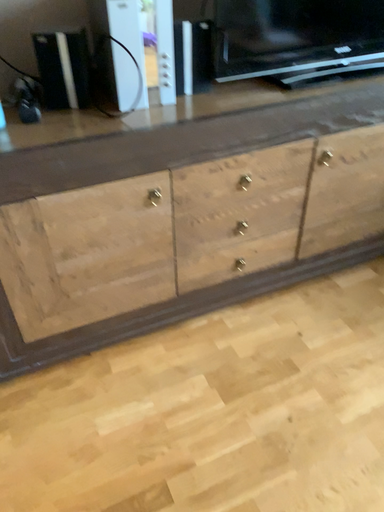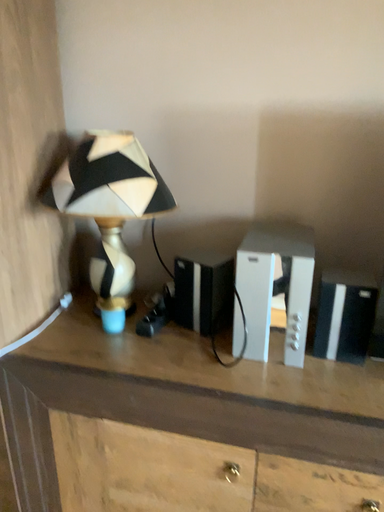
Question: How did the camera likely rotate when shooting the video?

Choices:
 (A) rotated upward
 (B) rotated downward

Answer: (A)